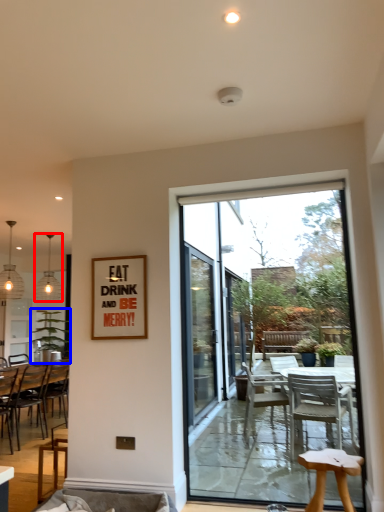
Question: Which of the following is the closest to the observer, lamp (highlighted by a red box) or houseplant (highlighted by a blue box)?

Choices:
 (A) lamp
 (B) houseplant

Answer: (B)